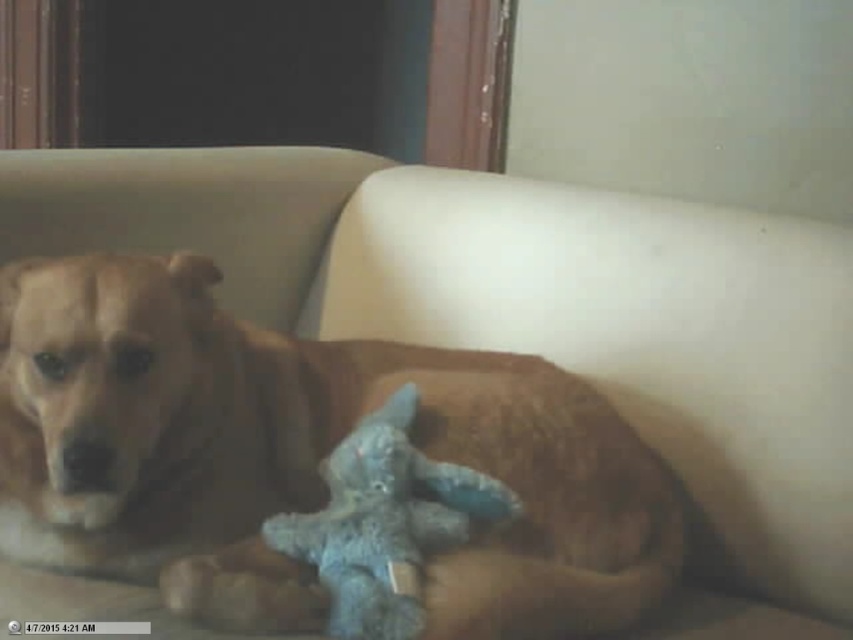
Measure the distance between golden brown fur at center and blue plush toy at center.

golden brown fur at center and blue plush toy at center are 4.29 inches apart.

Is point (202, 490) behind point (399, 547)?

Yes, it is.

Who is more distant from viewer, [192,593] or [375,472]?

The point [375,472] is more distant.

Find the location of `golden brown fur at center`. golden brown fur at center is located at coordinates (300, 456).